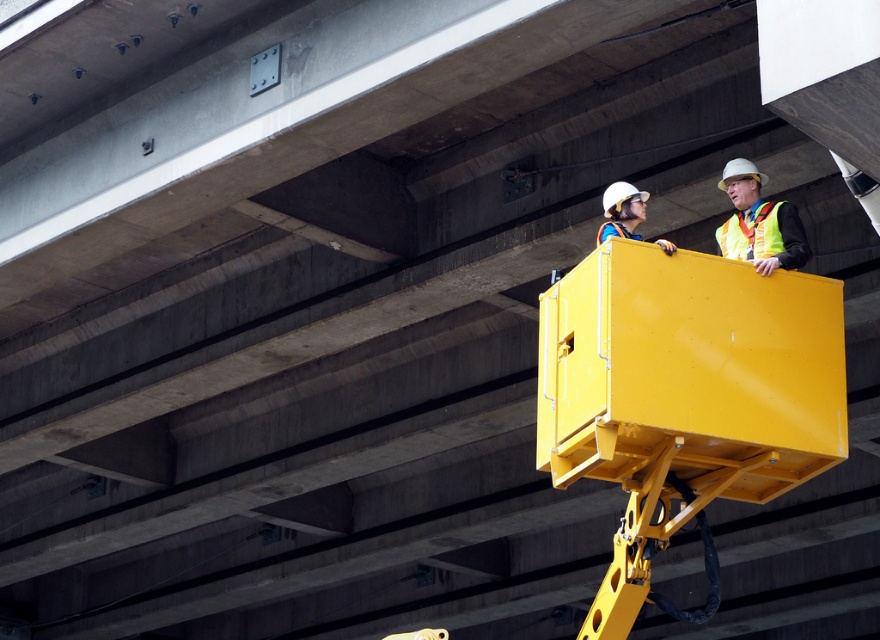
Which is in front, point (761, 204) or point (620, 225)?

Positioned in front is point (620, 225).

Which is above, yellow reflective vest at upper right or white hard hat at upper center?

yellow reflective vest at upper right

Does point (745, 225) lie behind point (624, 193)?

That is True.

Locate an element on the screen. This screenshot has height=640, width=880. yellow reflective vest at upper right is located at coordinates (759, 221).